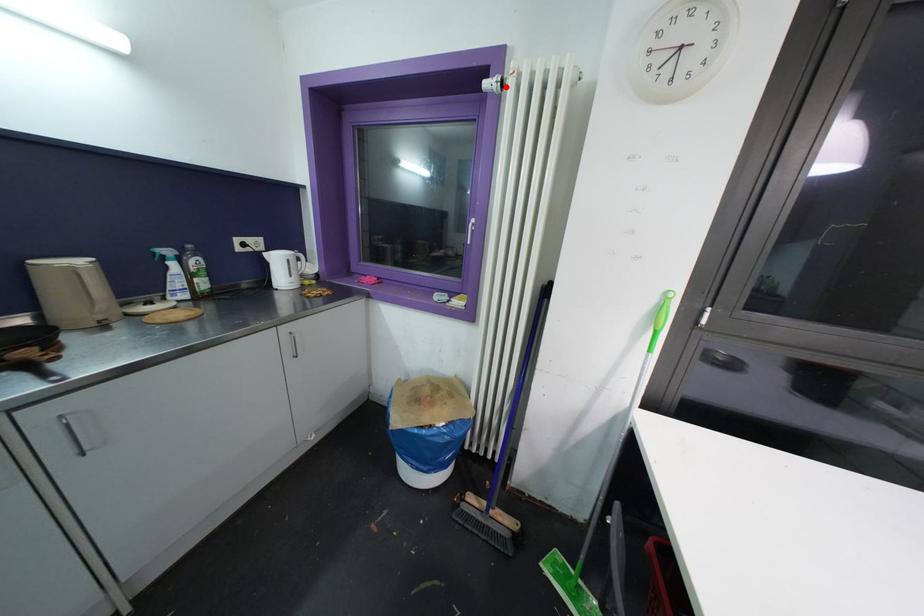
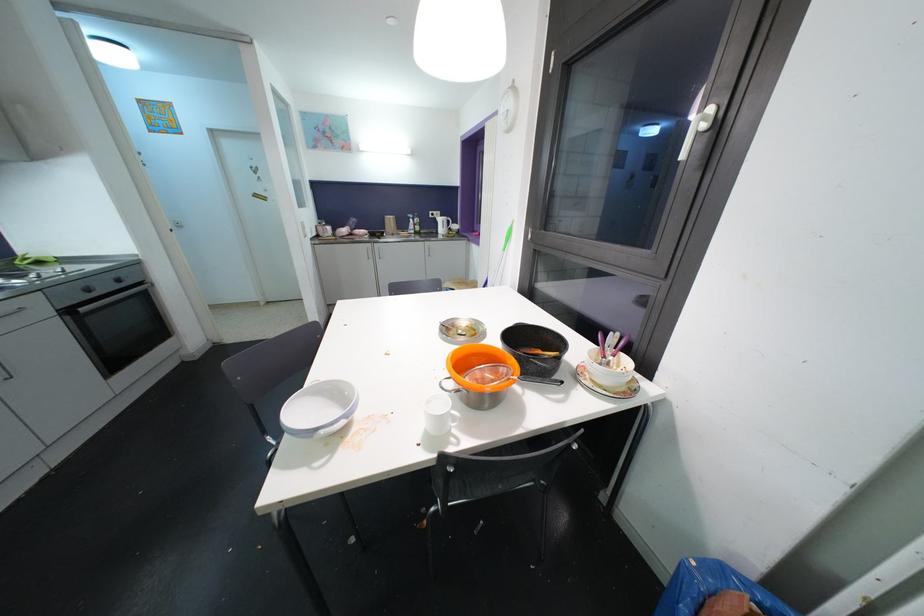
Question: I am providing you with two images of the same scene from different viewpoints. A red point is marked on the first image. At the location where the point appears in image 1, is it still visible in image 2?

Choices:
 (A) Yes
 (B) No

Answer: (B)